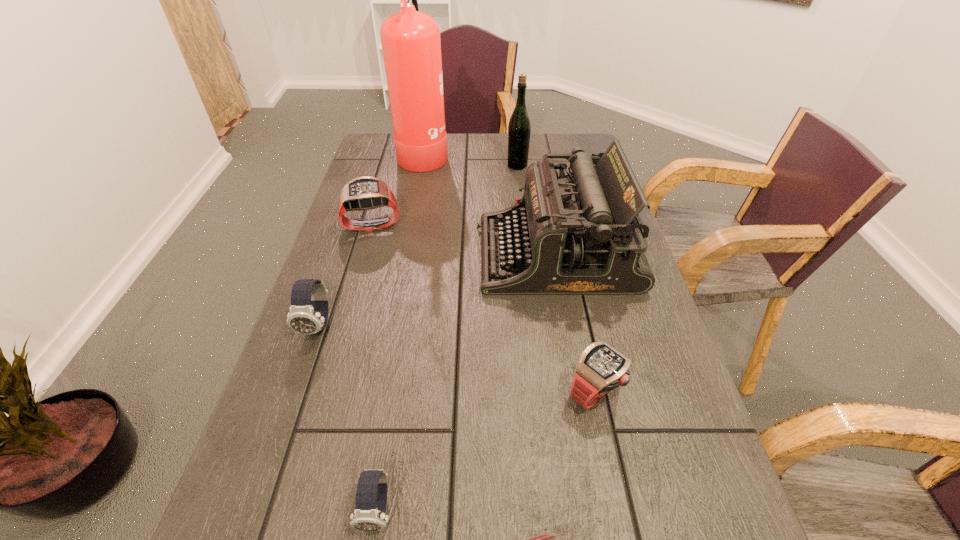
At what (x,y) coordinates should I click in order to perform the action: click on red fire extinguisher. Please return your answer as a coordinate pair (x, y). Image resolution: width=960 pixels, height=540 pixels. Looking at the image, I should click on (411, 44).

Identify the location of the tallest object. (411, 44).

You are a GUI agent. You are given a task and a screenshot of the screen. Output one action in this format:
    pyautogui.click(x=<x>, y=<y>)
    Task: Click on the green beer bottle
    The height and width of the screenshot is (540, 960).
    Given the screenshot: What is the action you would take?
    pyautogui.click(x=519, y=128)

This screenshot has height=540, width=960. I want to click on typewriter, so click(577, 234).

Image resolution: width=960 pixels, height=540 pixels. What are the coordinates of `the biggest red watch` in the screenshot? It's located at (363, 193).

Image resolution: width=960 pixels, height=540 pixels. In order to click on the farthest red watch in this screenshot , I will do `click(363, 193)`.

You are a GUI agent. You are given a task and a screenshot of the screen. Output one action in this format:
    pyautogui.click(x=<x>, y=<y>)
    Task: Click on the fifth farthest object
    The image size is (960, 540).
    Given the screenshot: What is the action you would take?
    pyautogui.click(x=308, y=314)

Locate an element on the screen. The width and height of the screenshot is (960, 540). the fourth nearest watch is located at coordinates (308, 314).

Where is `the rightmost watch`? This screenshot has width=960, height=540. the rightmost watch is located at coordinates (601, 368).

At what (x,y) coordinates should I click in order to perform the action: click on the second farthest red watch. Please return your answer as a coordinate pair (x, y). Looking at the image, I should click on (601, 368).